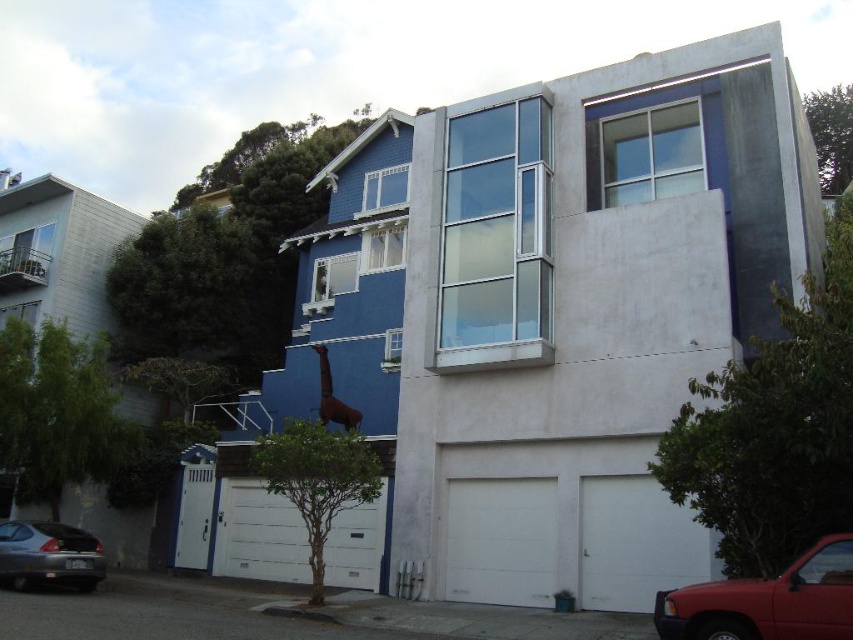
From the picture: Can you confirm if green leafy tree at right is wider than white matte/glossy garage door at center?

Incorrect, green leafy tree at right's width does not surpass white matte/glossy garage door at center's.

Is point (764, 376) closer to viewer compared to point (254, 538)?

Yes, it is in front of point (254, 538).

Find the location of a particular element. The image size is (853, 640). green leafy tree at right is located at coordinates (775, 428).

Does white matte/glossy garage door at center have a greater height compared to green leafy tree at lower left?

Indeed, white matte/glossy garage door at center has a greater height compared to green leafy tree at lower left.

Measure the distance between point (366, 508) and camera.

Point (366, 508) is 14.03 meters away from camera.

The height and width of the screenshot is (640, 853). What are the coordinates of `white matte/glossy garage door at center` in the screenshot? It's located at (258, 534).

Image resolution: width=853 pixels, height=640 pixels. I want to click on white matte/glossy garage door at center, so click(258, 534).

Is shiny red truck at lower right below white matte/glossy garage door at center?

No.

Does shiny red truck at lower right appear on the right side of white matte/glossy garage door at center?

Correct, you'll find shiny red truck at lower right to the right of white matte/glossy garage door at center.

Locate an element on the screen. shiny red truck at lower right is located at coordinates (767, 602).